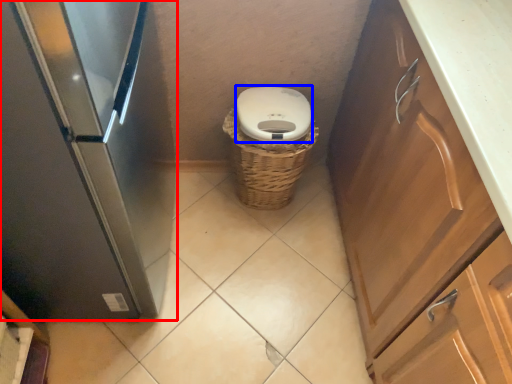
Question: Which of the following is the farthest to the observer, home appliance (highlighted by a red box) or toilet bowl (highlighted by a blue box)?

Choices:
 (A) home appliance
 (B) toilet bowl

Answer: (B)